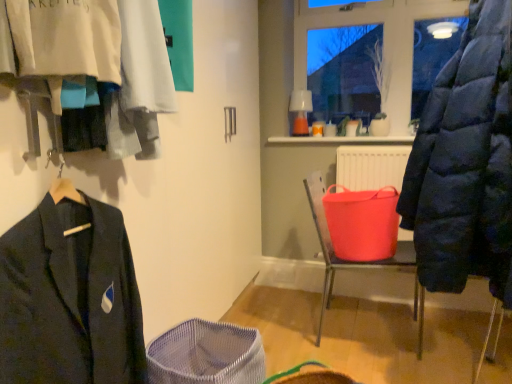
This screenshot has height=384, width=512. Find the location of `vacant space underneath rubberized plastic bucket at center (from a real-world perspective)`. vacant space underneath rubberized plastic bucket at center (from a real-world perspective) is located at coordinates (356, 328).